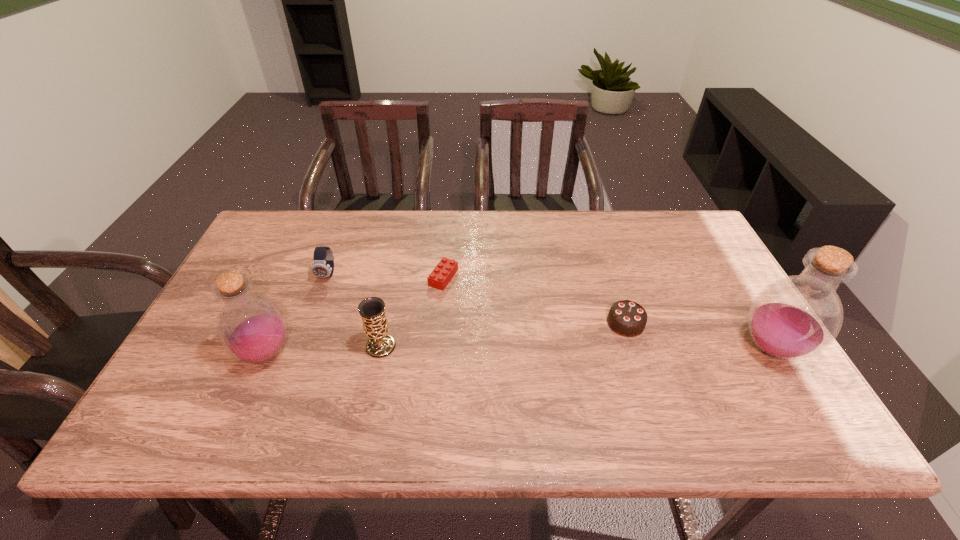
I want to click on empty location between the fourth object from right to left and the watch, so click(x=354, y=310).

Find the location of a particular element. vacant area between the third shortest object and the right bottle is located at coordinates (550, 312).

Where is `vacant area between the fourth tallest object and the Lego`? This screenshot has height=540, width=960. vacant area between the fourth tallest object and the Lego is located at coordinates (386, 276).

At what (x,y) coordinates should I click in order to perform the action: click on vacant area between the second shortest object and the shorter bottle. Please return your answer as a coordinate pair (x, y). The image size is (960, 540). Looking at the image, I should click on (446, 339).

Locate an element on the screen. The width and height of the screenshot is (960, 540). unoccupied position between the fifth shortest object and the rightmost object is located at coordinates (519, 351).

Image resolution: width=960 pixels, height=540 pixels. I want to click on vacant space that's between the fourth object from left to right and the chocolate cake, so click(535, 300).

Identify which object is the fourth closest to the watch. Please provide its 2D coordinates. Your answer should be formatted as a tuple, i.e. [(x, y)], where the tuple contains the x and y coordinates of a point satisfying the conditions above.

[(626, 318)]

Point out which object is positioned as the nearest to the watch. Please provide its 2D coordinates. Your answer should be formatted as a tuple, i.e. [(x, y)], where the tuple contains the x and y coordinates of a point satisfying the conditions above.

[(252, 328)]

This screenshot has width=960, height=540. What are the coordinates of `vacant space that satisfies the following two spatial constraints: 1. on the front side of the rightmost object; 2. on the right side of the Lego` in the screenshot? It's located at (437, 348).

Identify the location of vacant region that satisfies the following two spatial constraints: 1. on the face of the tallest object; 2. on the right side of the third shortest object. This screenshot has width=960, height=540. (301, 348).